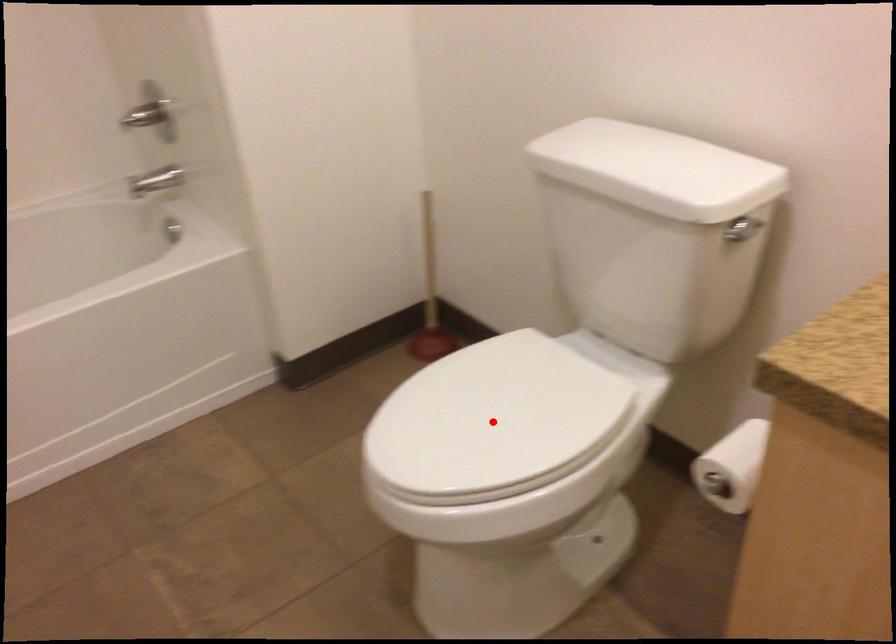
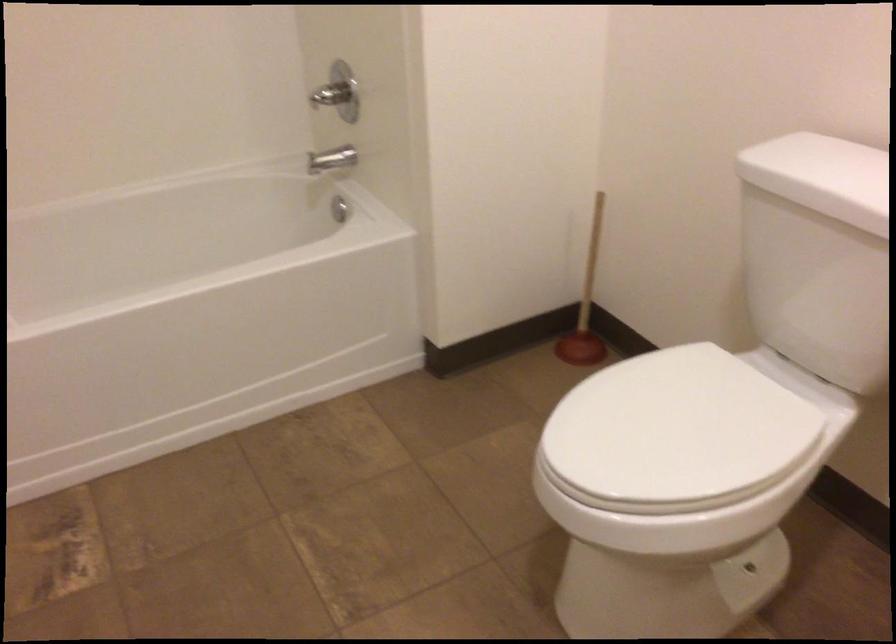
In the second image, find the point that corresponds to the highlighted location in the first image.

(675, 431)